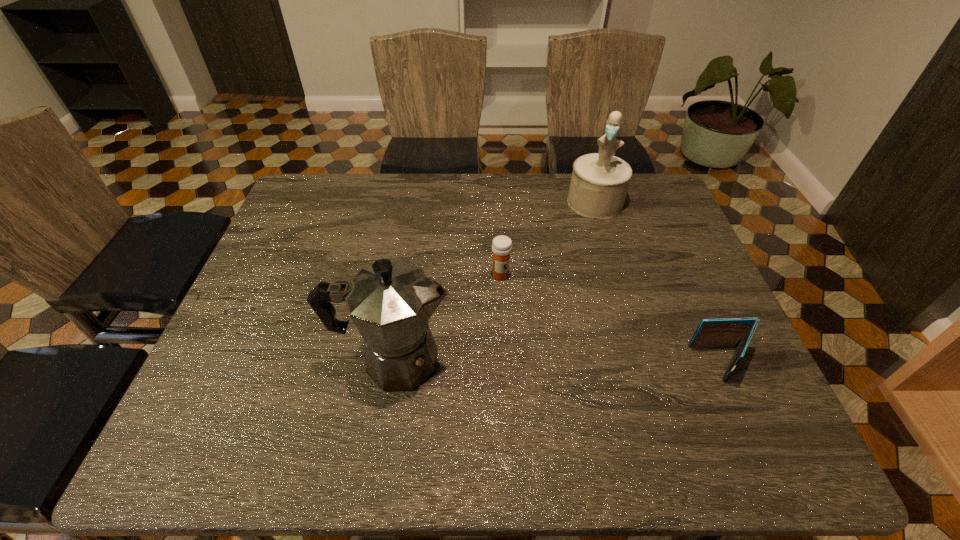
This screenshot has width=960, height=540. In order to click on wallet positioned at the right edge in this screenshot , I will do `click(731, 332)`.

Locate an element on the screen. This screenshot has width=960, height=540. figurine located in the right edge section of the desktop is located at coordinates 599,183.

Find the location of a particular element. This screenshot has height=540, width=960. object at the far right corner is located at coordinates (599, 183).

Image resolution: width=960 pixels, height=540 pixels. Identify the location of object that is at the near right corner. (731, 332).

Identify the location of vacant space at the far edge of the desktop. Image resolution: width=960 pixels, height=540 pixels. (405, 186).

I want to click on blank space at the near edge of the desktop, so coord(363,393).

Identify the location of vacant space at the left edge of the desktop. (280, 240).

The image size is (960, 540). I want to click on vacant space at the right edge of the desktop, so click(x=636, y=219).

The height and width of the screenshot is (540, 960). I want to click on vacant space at the far left corner of the desktop, so click(x=343, y=191).

I want to click on vacant region at the far right corner of the desktop, so click(652, 213).